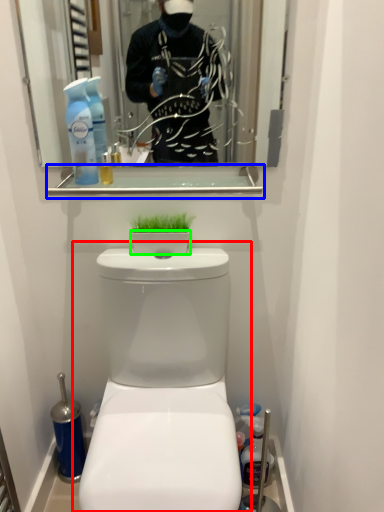
Question: Which is farther away from toilet (highlighted by a red box)? balustrade (highlighted by a blue box) or toilet bowl (highlighted by a green box)?

Choices:
 (A) balustrade
 (B) toilet bowl

Answer: (A)